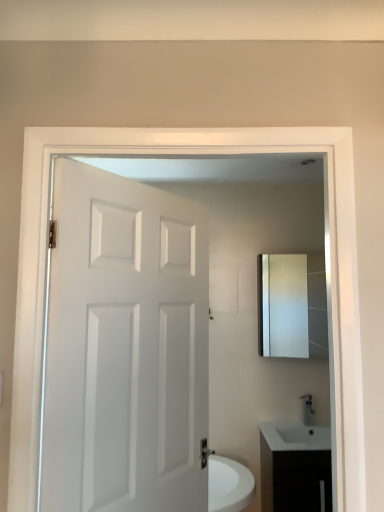
Question: From a real-world perspective, is matte silver medicine cabinet at upper right below white glossy cabinet at lower right?

Choices:
 (A) yes
 (B) no

Answer: (B)

Question: Is matte silver medicine cabinet at upper right oriented away from white glossy cabinet at lower right?

Choices:
 (A) yes
 (B) no

Answer: (B)

Question: From a real-world perspective, is matte silver medicine cabinet at upper right over white glossy cabinet at lower right?

Choices:
 (A) no
 (B) yes

Answer: (B)

Question: Is matte silver medicine cabinet at upper right not within white glossy cabinet at lower right?

Choices:
 (A) yes
 (B) no

Answer: (A)

Question: Does matte silver medicine cabinet at upper right touch white glossy cabinet at lower right?

Choices:
 (A) yes
 (B) no

Answer: (B)

Question: From their relative heights in the image, would you say white glossy cabinet at lower right is taller or shorter than white matte door at center?

Choices:
 (A) short
 (B) tall

Answer: (A)

Question: Considering the relative positions of white glossy cabinet at lower right and white matte door at center in the image provided, is white glossy cabinet at lower right to the left or to the right of white matte door at center?

Choices:
 (A) right
 (B) left

Answer: (A)

Question: Considering their positions, is white glossy cabinet at lower right located in front of or behind white matte door at center?

Choices:
 (A) behind
 (B) front

Answer: (A)

Question: From a real-world perspective, is white glossy cabinet at lower right physically located above or below white matte door at center?

Choices:
 (A) above
 (B) below

Answer: (B)

Question: Visually, is white glossy cabinet at lower right positioned to the left or to the right of matte silver medicine cabinet at upper right?

Choices:
 (A) right
 (B) left

Answer: (B)

Question: In terms of height, does white glossy cabinet at lower right look taller or shorter compared to matte silver medicine cabinet at upper right?

Choices:
 (A) short
 (B) tall

Answer: (A)

Question: Is white glossy cabinet at lower right wider or thinner than matte silver medicine cabinet at upper right?

Choices:
 (A) wide
 (B) thin

Answer: (A)

Question: Considering their positions, is white glossy cabinet at lower right located in front of or behind matte silver medicine cabinet at upper right?

Choices:
 (A) front
 (B) behind

Answer: (A)

Question: In terms of width, does white glossy cabinet at lower right look wider or thinner when compared to satin nickel faucet at lower right?

Choices:
 (A) wide
 (B) thin

Answer: (A)

Question: Is white glossy cabinet at lower right to the left or to the right of satin nickel faucet at lower right in the image?

Choices:
 (A) right
 (B) left

Answer: (B)